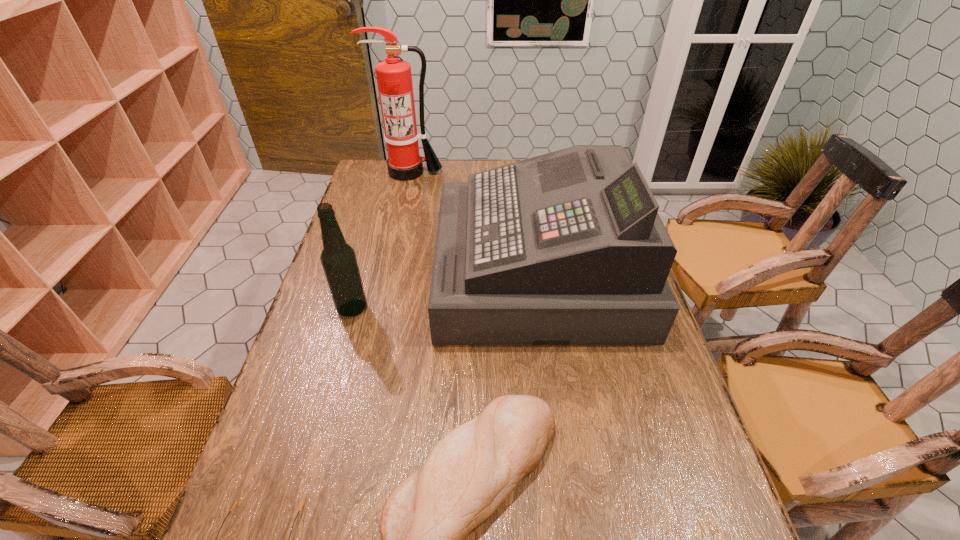
This screenshot has width=960, height=540. What are the coordinates of `fire extinguisher at the left edge` in the screenshot? It's located at (394, 78).

At what (x,y) coordinates should I click in order to perform the action: click on alcohol that is at the left edge. Please return your answer as a coordinate pair (x, y). Image resolution: width=960 pixels, height=540 pixels. Looking at the image, I should click on (338, 258).

I want to click on object situated at the right edge, so click(x=567, y=248).

Locate an element on the screen. The height and width of the screenshot is (540, 960). object at the far left corner is located at coordinates (394, 78).

At what (x,y) coordinates should I click in order to perform the action: click on vacant space at the far edge of the desktop. Please return your answer as a coordinate pair (x, y). Looking at the image, I should click on (426, 170).

Image resolution: width=960 pixels, height=540 pixels. I want to click on vacant space at the left edge, so (395, 216).

I want to click on free space at the far left corner of the desktop, so point(389,178).

Find the location of `empty location between the tallest object and the alcohol`. empty location between the tallest object and the alcohol is located at coordinates (380, 240).

This screenshot has width=960, height=540. Find the location of `object that is the fourth nearest to the alcohol`. object that is the fourth nearest to the alcohol is located at coordinates (394, 78).

I want to click on object that is the fourth nearest to the cash register, so click(236, 503).